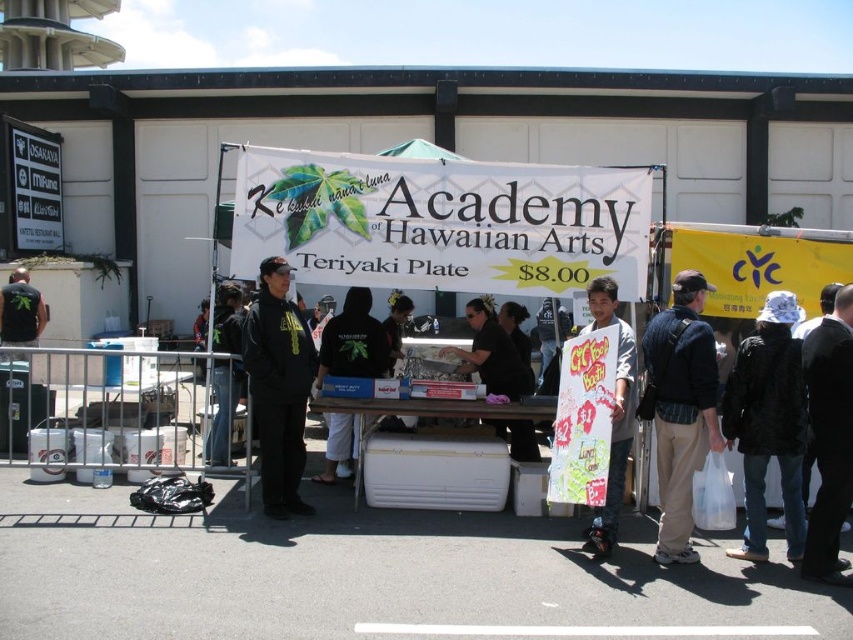
Between dark blue jacket at center and black hoodie at center, which one has less height?

black hoodie at center is shorter.

Does point (663, 323) come in front of point (320, 368)?

Yes, it is.

Image resolution: width=853 pixels, height=640 pixels. Identify the location of dark blue jacket at center. (680, 408).

Is white cotton hat at lower right above black matte hoodie at center?

Actually, white cotton hat at lower right is below black matte hoodie at center.

Can you confirm if white cotton hat at lower right is bigger than black matte hoodie at center?

Indeed, white cotton hat at lower right has a larger size compared to black matte hoodie at center.

The height and width of the screenshot is (640, 853). Find the location of `white cotton hat at lower right`. white cotton hat at lower right is located at coordinates (769, 422).

Does point (666, 403) come behind point (282, 516)?

No, (666, 403) is in front of (282, 516).

The width and height of the screenshot is (853, 640). Find the location of `dark blue jacket at center`. dark blue jacket at center is located at coordinates (680, 408).

Locate an element on the screen. The image size is (853, 640). dark blue jacket at center is located at coordinates (680, 408).